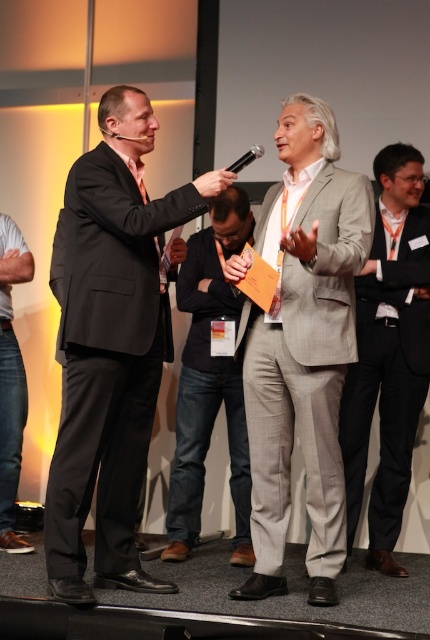
Question: In this image, where is gray textured suit at center located relative to black plastic microphone at center?

Choices:
 (A) above
 (B) below

Answer: (B)

Question: Can you confirm if gray textured suit at center is positioned to the right of dark gray jeans at center?

Choices:
 (A) no
 (B) yes

Answer: (B)

Question: Among these points, which one is nearest to the camera?

Choices:
 (A) (279, 348)
 (B) (237, 493)

Answer: (A)

Question: Can you confirm if denim jeans at lower left is thinner than black plastic microphone at center?

Choices:
 (A) no
 (B) yes

Answer: (A)

Question: Which point is closer to the camera taking this photo?

Choices:
 (A) (236, 161)
 (B) (111, 209)
 (C) (9, 412)
 (D) (255, 513)

Answer: (B)

Question: Which point is closer to the camera taking this photo?

Choices:
 (A) (205, 228)
 (B) (6, 486)
 (C) (249, 157)

Answer: (C)